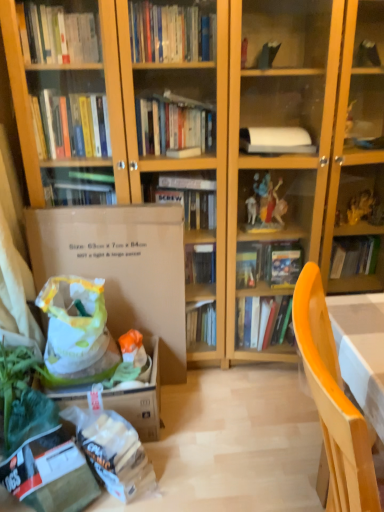
Question: Is the surface of wooden chair at lower right in direct contact with white plastic grocery bag at lower left?

Choices:
 (A) no
 (B) yes

Answer: (A)

Question: Does wooden chair at lower right turn towards white plastic grocery bag at lower left?

Choices:
 (A) no
 (B) yes

Answer: (A)

Question: From a real-world perspective, is wooden chair at lower right beneath white plastic grocery bag at lower left?

Choices:
 (A) yes
 (B) no

Answer: (B)

Question: Is wooden chair at lower right behind white plastic grocery bag at lower left?

Choices:
 (A) yes
 (B) no

Answer: (B)

Question: Can you confirm if wooden chair at lower right is thinner than white plastic grocery bag at lower left?

Choices:
 (A) no
 (B) yes

Answer: (B)

Question: Does point (147, 298) appear closer or farther from the camera than point (87, 329)?

Choices:
 (A) farther
 (B) closer

Answer: (A)

Question: In terms of size, does brown cardboard box at left appear bigger or smaller than white plastic grocery bag at lower left?

Choices:
 (A) big
 (B) small

Answer: (A)

Question: Is brown cardboard box at left to the left or to the right of white plastic grocery bag at lower left in the image?

Choices:
 (A) left
 (B) right

Answer: (B)

Question: From a real-world perspective, is brown cardboard box at left physically located above or below white plastic grocery bag at lower left?

Choices:
 (A) above
 (B) below

Answer: (A)

Question: Choose the correct answer: Is white plastic grocery bag at lower left inside wooden chair at lower right or outside it?

Choices:
 (A) outside
 (B) inside

Answer: (A)

Question: In terms of width, does white plastic grocery bag at lower left look wider or thinner when compared to wooden chair at lower right?

Choices:
 (A) thin
 (B) wide

Answer: (B)

Question: From a real-world perspective, is white plastic grocery bag at lower left positioned above or below wooden chair at lower right?

Choices:
 (A) below
 (B) above

Answer: (A)

Question: From the image's perspective, is white plastic grocery bag at lower left above or below wooden chair at lower right?

Choices:
 (A) above
 (B) below

Answer: (A)

Question: Considering the positions of white plastic grocery bag at lower left and brown cardboard box at left in the image, is white plastic grocery bag at lower left bigger or smaller than brown cardboard box at left?

Choices:
 (A) big
 (B) small

Answer: (B)

Question: In the image, is white plastic grocery bag at lower left positioned in front of or behind brown cardboard box at left?

Choices:
 (A) behind
 (B) front

Answer: (B)